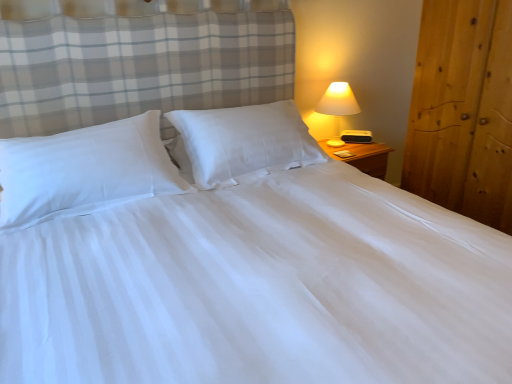
Question: Is wooden wardrobe at right taller or shorter than white smooth pillow at center, positioned as the 1th pillow in right-to-left order?

Choices:
 (A) tall
 (B) short

Answer: (A)

Question: Is point (494, 190) positioned closer to the camera than point (285, 99)?

Choices:
 (A) farther
 (B) closer

Answer: (B)

Question: Based on their relative distances, which object is nearer to the matte white lamp at right?

Choices:
 (A) white smooth pillow at center, which is the 2th pillow from left to right
 (B) white smooth pillow at left, acting as the second pillow starting from the right
 (C) wooden wardrobe at right

Answer: (C)

Question: Which object is positioned closest to the white smooth pillow at center, which is the 2th pillow from left to right?

Choices:
 (A) matte white lamp at right
 (B) white smooth pillow at left, acting as the second pillow starting from the right
 (C) wooden wardrobe at right

Answer: (B)